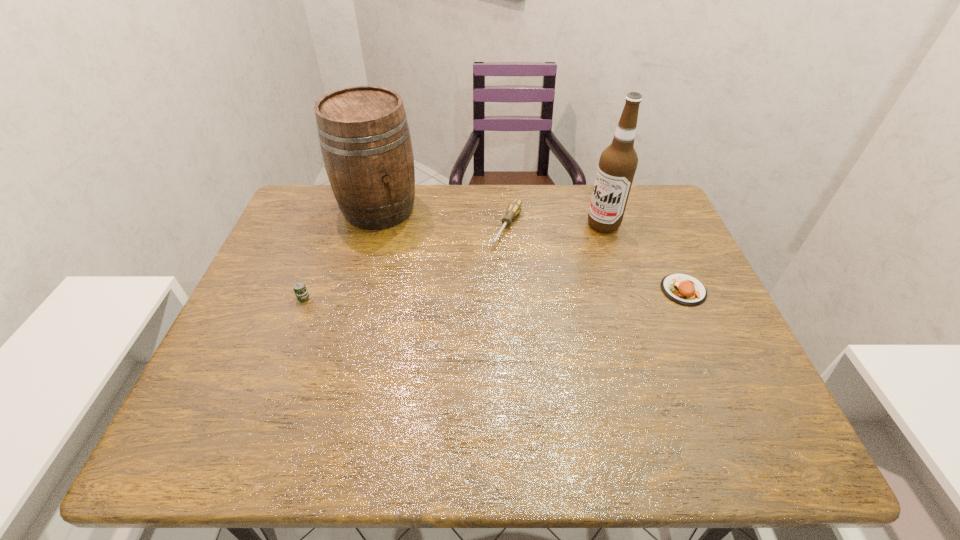
You are a GUI agent. You are given a task and a screenshot of the screen. Output one action in this format:
    pyautogui.click(x=<x>, y=<y>)
    Task: Click on the vacant area situated on the label of the alcohol
    This screenshot has height=540, width=960.
    Given the screenshot: What is the action you would take?
    click(529, 279)

At what (x,y) coordinates should I click in order to perform the action: click on vacant space located on the label of the alcohol. Please return your answer as a coordinate pair (x, y). The image size is (960, 540). Looking at the image, I should click on (551, 263).

The height and width of the screenshot is (540, 960). What are the coordinates of `vacant area situated on the label of the alcohol` in the screenshot? It's located at (551, 263).

Find the location of a particular element. vacant area situated on the side of the cider near the bung hole is located at coordinates (403, 242).

You are a GUI agent. You are given a task and a screenshot of the screen. Output one action in this format:
    pyautogui.click(x=<x>, y=<y>)
    Task: Click on the vacant position located on the side of the cider near the bung hole
    
    Given the screenshot: What is the action you would take?
    pyautogui.click(x=460, y=319)

Where is `free space located 0.180m on the side of the cider near the bung hole`? This screenshot has width=960, height=540. free space located 0.180m on the side of the cider near the bung hole is located at coordinates (421, 267).

Where is `screwdriver present at the far edge`? This screenshot has height=540, width=960. screwdriver present at the far edge is located at coordinates (514, 208).

Image resolution: width=960 pixels, height=540 pixels. In order to click on alcohol present at the far edge in this screenshot , I will do `click(618, 162)`.

You are a GUI agent. You are given a task and a screenshot of the screen. Output one action in this format:
    pyautogui.click(x=<x>, y=<y>)
    Task: Click on the cider that is at the far edge
    The height and width of the screenshot is (540, 960).
    Given the screenshot: What is the action you would take?
    pyautogui.click(x=364, y=136)

At what (x,y) coordinates should I click in order to perform the action: click on beer can present at the left edge. Please return your answer as a coordinate pair (x, y). Looking at the image, I should click on (301, 292).